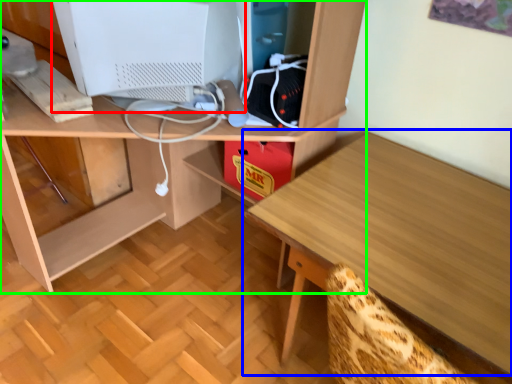
Question: Based on their relative distances, which object is nearer to computer monitor (highlighted by a red box)? Choose from table (highlighted by a blue box) and desk (highlighted by a green box).

Choices:
 (A) table
 (B) desk

Answer: (B)